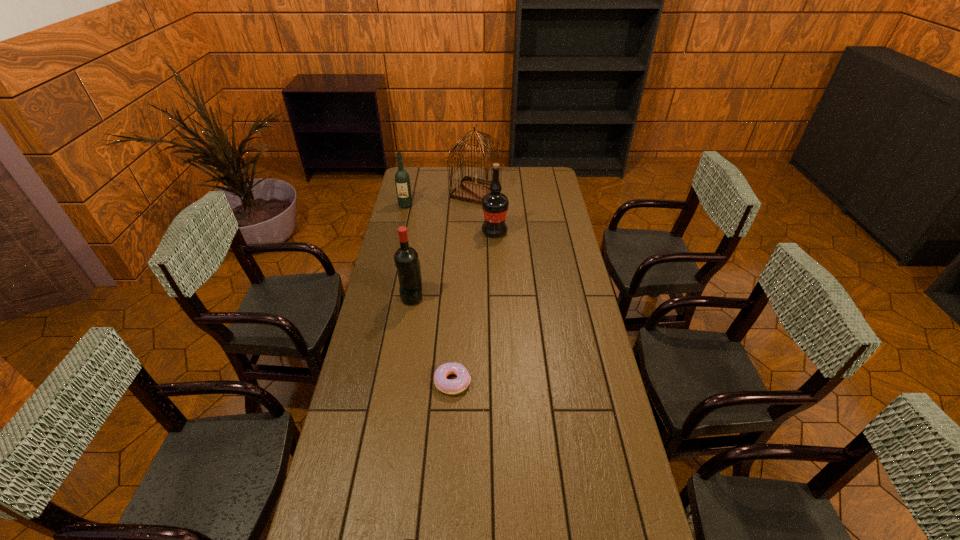
Identify the location of birdcage. This screenshot has height=540, width=960. (471, 189).

This screenshot has height=540, width=960. Find the location of `the second nearest wine bottle`. the second nearest wine bottle is located at coordinates (495, 205).

The height and width of the screenshot is (540, 960). What are the coordinates of `the third farthest object` in the screenshot? It's located at (495, 205).

At what (x,y) coordinates should I click in order to perform the action: click on the fourth farthest object. Please return your answer as a coordinate pair (x, y). The height and width of the screenshot is (540, 960). Looking at the image, I should click on (406, 259).

This screenshot has height=540, width=960. I want to click on the second wine bottle from left to right, so click(x=406, y=259).

Identify the location of the fourth tallest object. (402, 181).

The width and height of the screenshot is (960, 540). What are the coordinates of `the shortest wine bottle` in the screenshot? It's located at (402, 181).

Where is `doughnut`? doughnut is located at coordinates (448, 386).

The height and width of the screenshot is (540, 960). I want to click on the second nearest object, so click(x=448, y=386).

I want to click on free region located on the right of the birdcage, so click(541, 192).